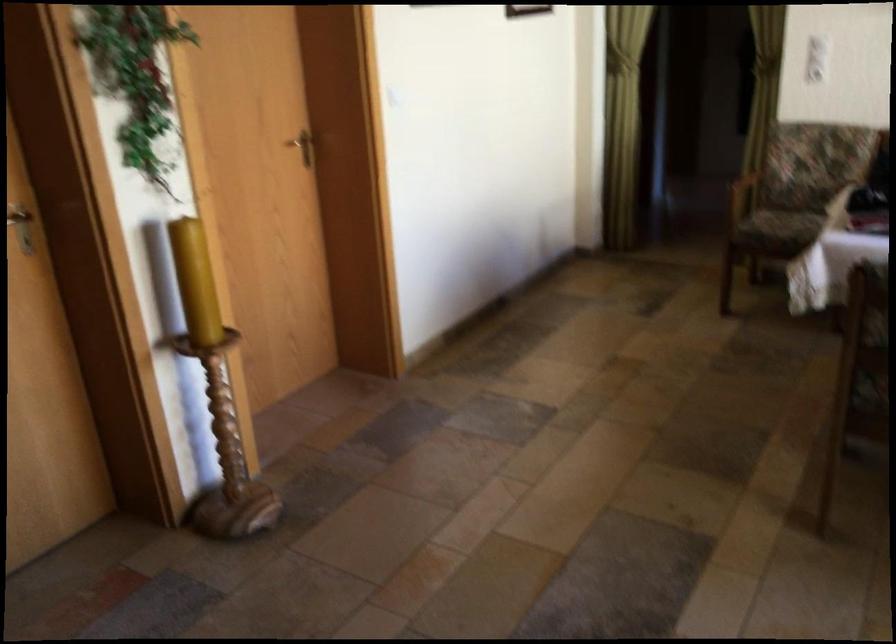
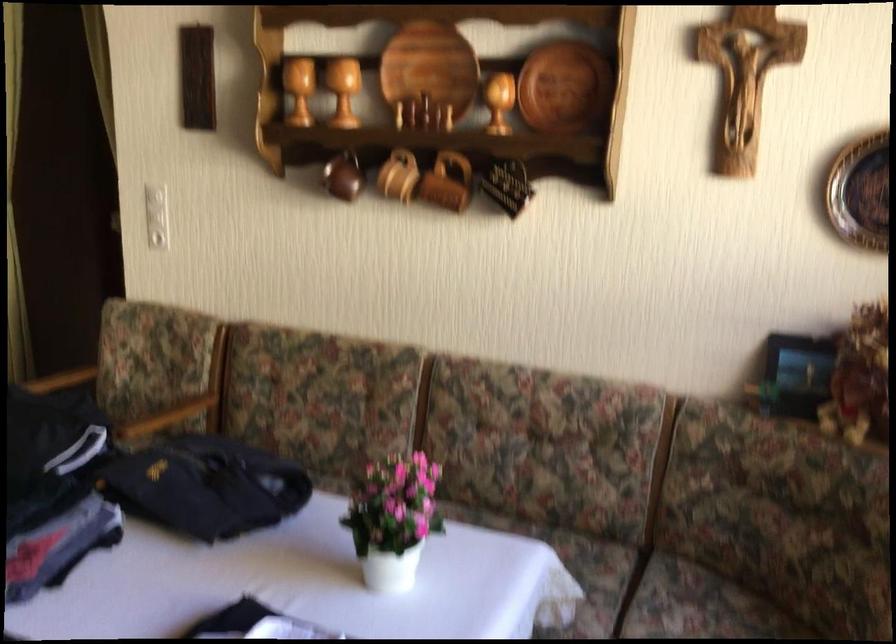
Consider the image. Which direction would the cameraman need to move to produce the second image?

The cameraman walked toward right, forward.